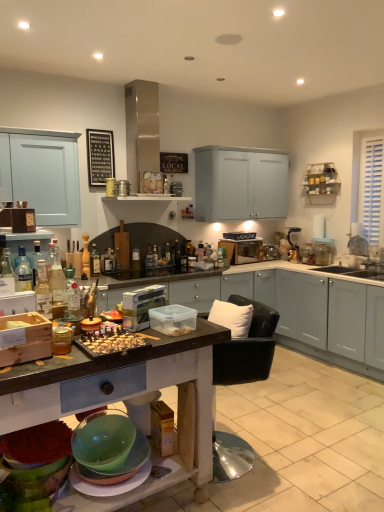
Question: Is point (292, 260) closer or farther from the camera than point (233, 313)?

Choices:
 (A) farther
 (B) closer

Answer: (A)

Question: Considering the positions of metallic silver blender at upper right, which is counted as the third appliance, starting from the front, and white soft cushion at center in the image, is metallic silver blender at upper right, which is counted as the third appliance, starting from the front, wider or thinner than white soft cushion at center?

Choices:
 (A) thin
 (B) wide

Answer: (B)

Question: Which object is positioned closest to the wooden signboard at upper left?

Choices:
 (A) white ceramic sink at right
 (B) clear glass bottle at left, positioned as the 3th bottle in front-to-back order
 (C) metallic silver blender at upper right, arranged as the second appliance when ordered from the bottom
 (D) black leather chair at center
 (E) white soft cushion at center

Answer: (B)

Question: Estimate the real-world distances between objects in this image. Which object is farther from the translucent glass bottle at center, the 2th bottle from the back?

Choices:
 (A) white plastic toaster at center, which is the first appliance in front-to-back order
 (B) metallic silver shelves at upper right
 (C) clear glass bottle at left, arranged as the 2th bottle when viewed from the left
 (D) translucent glass bottle at left, acting as the 6th bottle starting from the back
 (E) metallic canister at center, which is counted as the first appliance, starting from the left

Answer: (D)